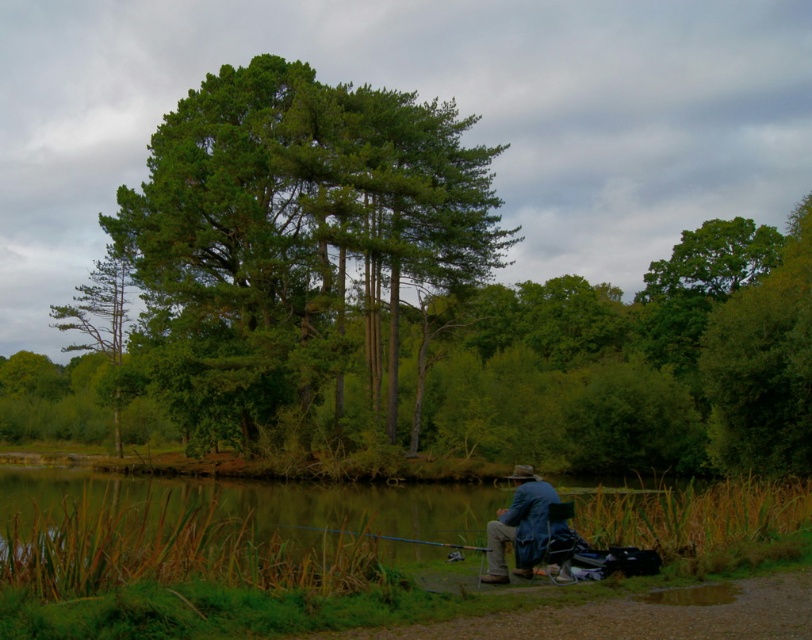
Can you confirm if green grassy water at lower left is smaller than blue metallic fishing pole at center?

Incorrect, green grassy water at lower left is not smaller in size than blue metallic fishing pole at center.

Who is positioned more to the left, green grassy water at lower left or blue metallic fishing pole at center?

Positioned to the left is blue metallic fishing pole at center.

Between point (296, 502) and point (412, 540), which one is positioned behind?

The point (296, 502) is behind.

Locate an element on the screen. The height and width of the screenshot is (640, 812). green grassy water at lower left is located at coordinates (242, 509).

Does point (76, 484) come farther from viewer compared to point (119, 356)?

No, it is in front of (119, 356).

Who is more distant from viewer, (55,474) or (110,307)?

The point (110,307) is behind.

The height and width of the screenshot is (640, 812). Find the location of `green grassy water at lower left`. green grassy water at lower left is located at coordinates (242, 509).

Where is `green grassy water at lower left`? The image size is (812, 640). green grassy water at lower left is located at coordinates (242, 509).

Is green grassy water at lower left wider than denim jacket at lower right?

Indeed, green grassy water at lower left has a greater width compared to denim jacket at lower right.

Is point (438, 554) farther from viewer compared to point (541, 547)?

Yes, point (438, 554) is behind point (541, 547).

Describe the element at coordinates (242, 509) in the screenshot. The width and height of the screenshot is (812, 640). I see `green grassy water at lower left` at that location.

The height and width of the screenshot is (640, 812). What are the coordinates of `green grassy water at lower left` in the screenshot? It's located at (242, 509).